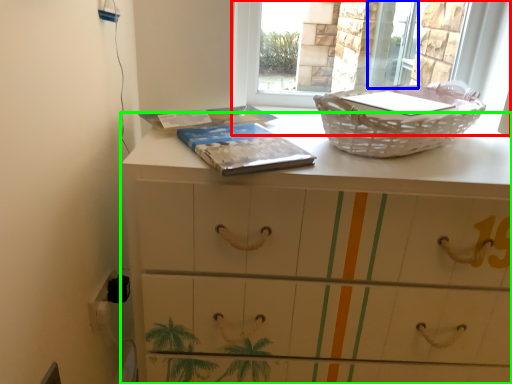
Question: Considering the real-world distances, which object is closest to window (highlighted by a red box)? screen door (highlighted by a blue box) or chest of drawers (highlighted by a green box).

Choices:
 (A) screen door
 (B) chest of drawers

Answer: (B)